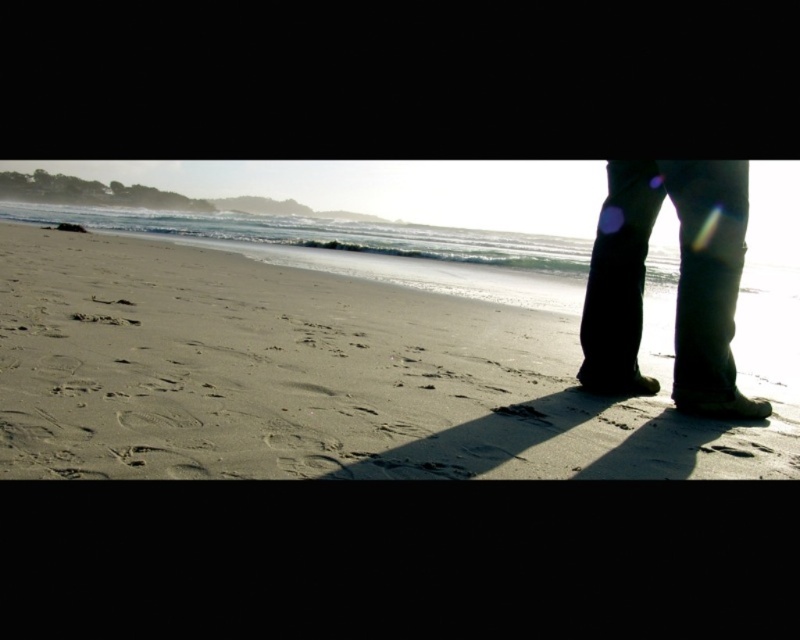
Question: Is sandy beach at lower center positioned before dark denim pants at lower right?

Choices:
 (A) yes
 (B) no

Answer: (A)

Question: Which of the following is the farthest from the observer?

Choices:
 (A) (680, 355)
 (B) (440, 410)

Answer: (A)

Question: Does sandy beach at lower center lie in front of dark denim pants at lower right?

Choices:
 (A) yes
 (B) no

Answer: (A)

Question: Which of the following is the closest to the observer?

Choices:
 (A) sandy beach at lower center
 (B) dark denim pants at lower right

Answer: (A)

Question: Can you confirm if sandy beach at lower center is positioned to the right of dark denim pants at lower right?

Choices:
 (A) yes
 (B) no

Answer: (A)